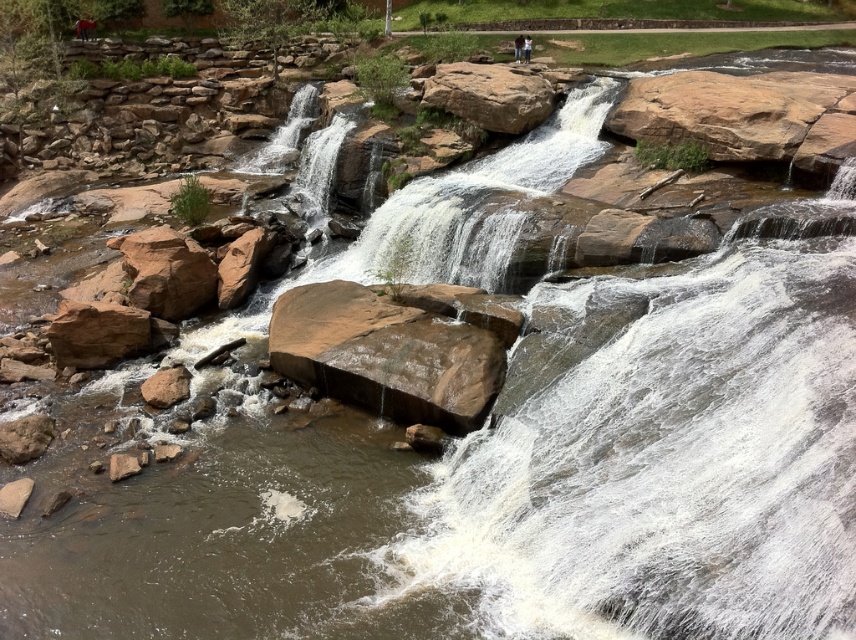
You are standing at the top of the waterfall and want to walk to the brown rough rock at lower left. Which direction should you move relative to the brown rough rock at upper center?

You should move towards the lower left direction relative to the brown rough rock at upper center because the brown rough rock at lower left is positioned below and to the left of it.